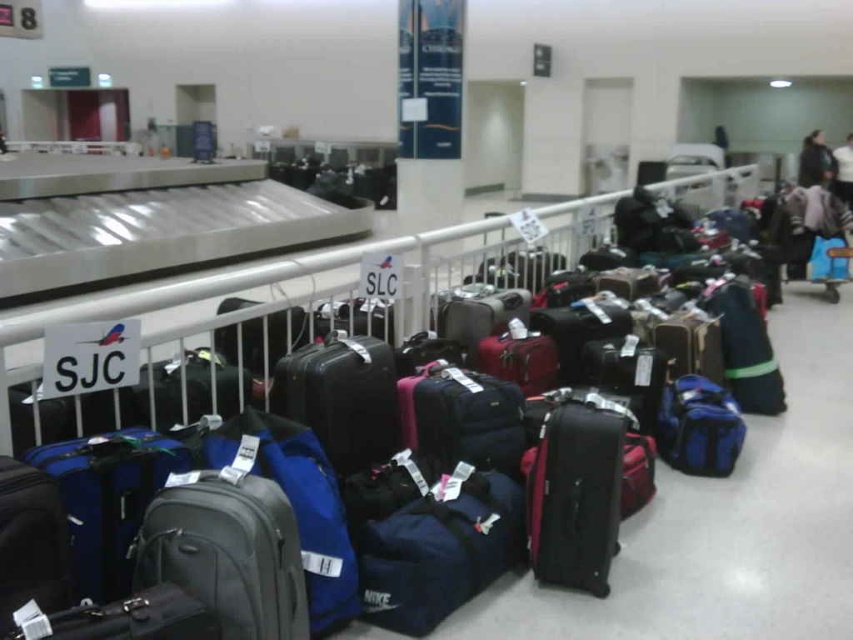
Can you confirm if matte black suitcase at center is positioned to the right of blue fabric duffel at center?

In fact, matte black suitcase at center is to the left of blue fabric duffel at center.

Who is more distant from viewer, (x=573, y=561) or (x=694, y=376)?

The point (x=694, y=376) is more distant.

Is point (602, 506) farther from camera compared to point (720, 467)?

No, (602, 506) is in front of (720, 467).

Locate an element on the screen. matte black suitcase at center is located at coordinates (575, 492).

Does point (310, 259) come in front of point (527, 509)?

No, (310, 259) is behind (527, 509).

Is metallic silver luggage carousel at center bigger than matte black suitcase at center?

Yes, metallic silver luggage carousel at center is bigger than matte black suitcase at center.

Image resolution: width=853 pixels, height=640 pixels. What do you see at coordinates (277, 321) in the screenshot?
I see `metallic silver luggage carousel at center` at bounding box center [277, 321].

Where is `metallic silver luggage carousel at center`? Image resolution: width=853 pixels, height=640 pixels. metallic silver luggage carousel at center is located at coordinates (277, 321).

Who is lower down, metallic silver luggage carousel at center or blue fabric duffel at center?

blue fabric duffel at center

Is metallic silver luggage carousel at center bigger than blue fabric duffel at center?

Yes.

Describe the element at coordinates (277, 321) in the screenshot. I see `metallic silver luggage carousel at center` at that location.

The height and width of the screenshot is (640, 853). Identify the location of metallic silver luggage carousel at center. (277, 321).